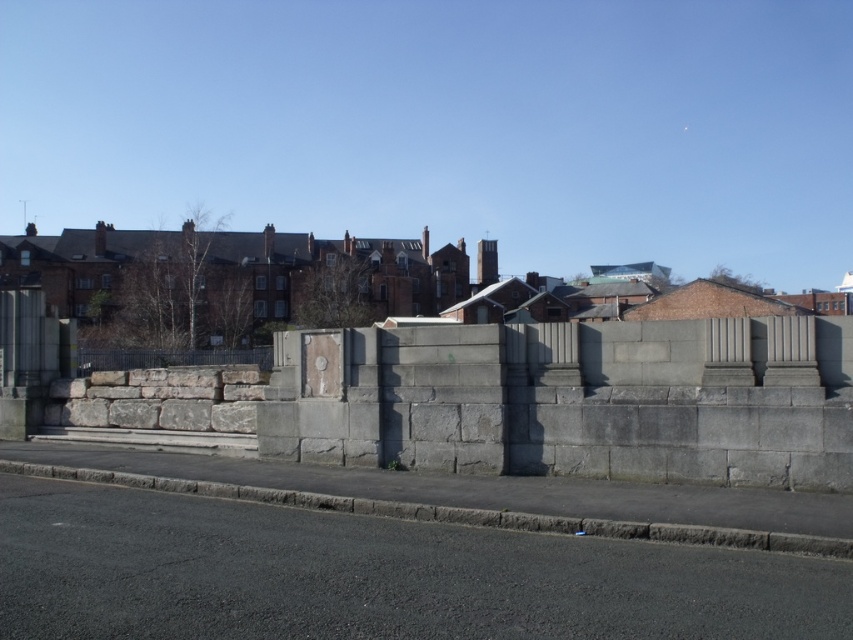
Is gray stone wall at center smaller than black wrought iron fence at left?

Yes, gray stone wall at center is smaller than black wrought iron fence at left.

Which is above, gray stone wall at center or black wrought iron fence at left?

black wrought iron fence at left

Locate an element on the screen. Image resolution: width=853 pixels, height=640 pixels. gray stone wall at center is located at coordinates (572, 400).

Locate an element on the screen. gray stone wall at center is located at coordinates (572, 400).